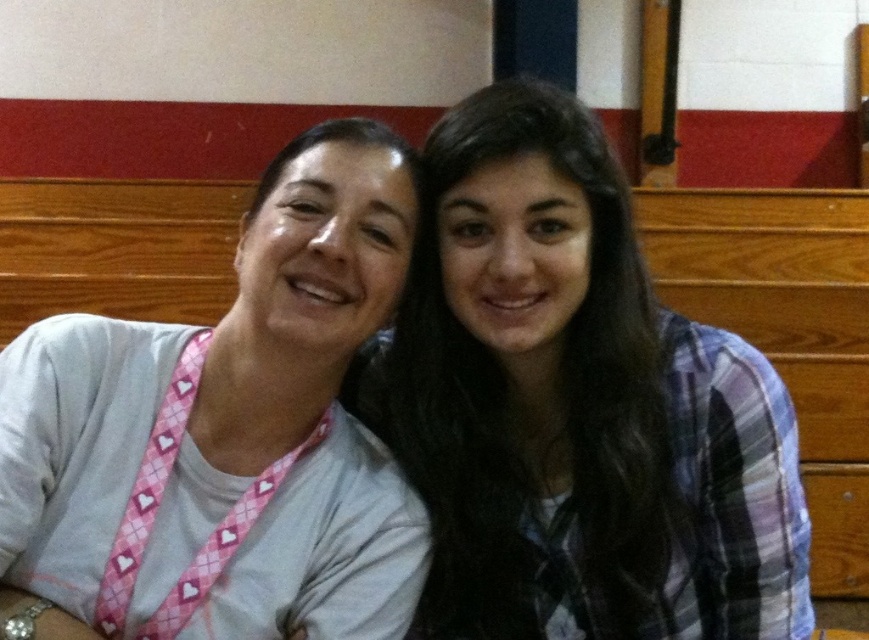
Question: Among these points, which one is nearest to the camera?

Choices:
 (A) (151, 588)
 (B) (503, 467)

Answer: (A)

Question: Can you confirm if plaid fabric shirt at center is thinner than pink argyle lanyard at left?

Choices:
 (A) no
 (B) yes

Answer: (A)

Question: Is plaid fabric shirt at center positioned in front of pink argyle lanyard at left?

Choices:
 (A) no
 (B) yes

Answer: (A)

Question: From the image, what is the correct spatial relationship of plaid fabric shirt at center in relation to pink argyle lanyard at left?

Choices:
 (A) left
 (B) right

Answer: (B)

Question: Which point appears farthest from the camera in this image?

Choices:
 (A) (90, 557)
 (B) (672, 548)

Answer: (B)